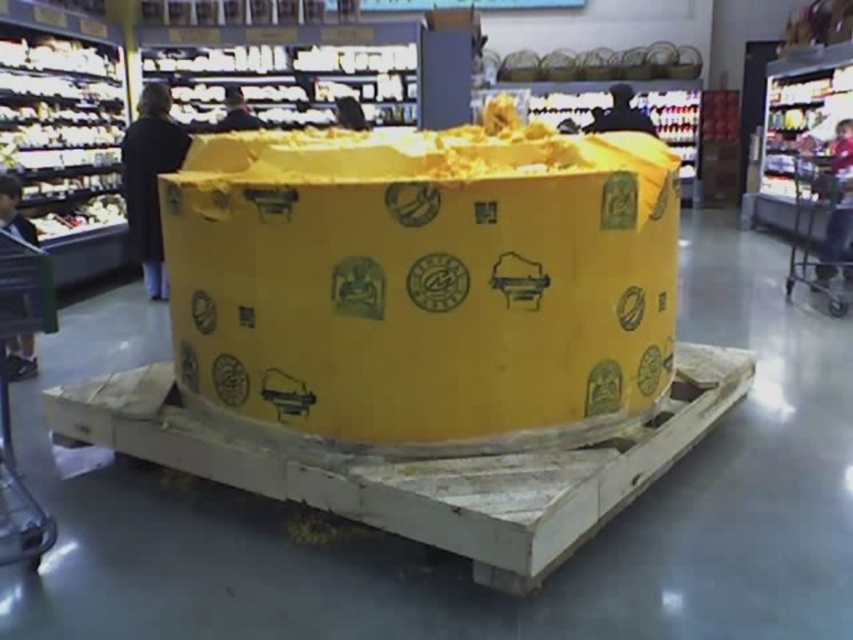
Question: Does yellow cardboard box at center have a lesser width compared to metallic silver shopping cart at lower left?

Choices:
 (A) no
 (B) yes

Answer: (A)

Question: Which point is closer to the camera?

Choices:
 (A) yellow cardboard box at center
 (B) metallic silver shopping cart at right
 (C) metallic silver shopping cart at lower left

Answer: (C)

Question: Which point is closer to the camera taking this photo?

Choices:
 (A) (27, 541)
 (B) (831, 262)
 (C) (309, 196)

Answer: (A)

Question: Can you confirm if yellow cardboard box at center is bigger than metallic silver shopping cart at lower left?

Choices:
 (A) yes
 (B) no

Answer: (A)

Question: Estimate the real-world distances between objects in this image. Which object is farther from the metallic silver shopping cart at right?

Choices:
 (A) metallic silver shopping cart at lower left
 (B) yellow cardboard box at center

Answer: (A)

Question: In this image, where is yellow cardboard box at center located relative to metallic silver shopping cart at lower left?

Choices:
 (A) above
 (B) below

Answer: (A)